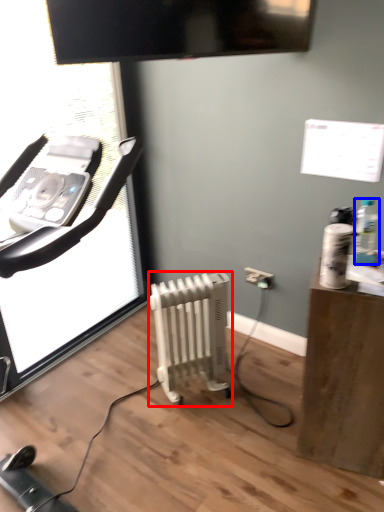
Question: Which point is further to the camera, radiator (highlighted by a red box) or bottle (highlighted by a blue box)?

Choices:
 (A) radiator
 (B) bottle

Answer: (A)